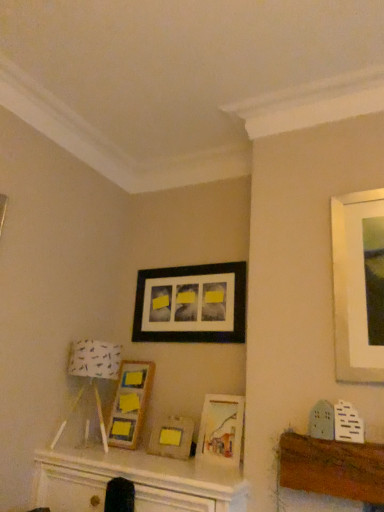
Question: Would you say black matte picture frame at upper center, which ranks as the 4th picture frame in bottom-to-top order, is part of matte silver picture frame at center, arranged as the first picture frame when ordered from the bottom,'s contents?

Choices:
 (A) no
 (B) yes

Answer: (A)

Question: From the image's perspective, is matte silver picture frame at center, which is counted as the fourth picture frame, starting from the top, under black matte picture frame at upper center, which ranks as the 4th picture frame in bottom-to-top order?

Choices:
 (A) no
 (B) yes

Answer: (B)

Question: Is matte silver picture frame at center, arranged as the first picture frame when ordered from the bottom, to the left of black matte picture frame at upper center, which ranks as the 4th picture frame in bottom-to-top order, from the viewer's perspective?

Choices:
 (A) yes
 (B) no

Answer: (A)

Question: Can you confirm if matte silver picture frame at center, which is counted as the fourth picture frame, starting from the top, is shorter than black matte picture frame at upper center, which ranks as the 4th picture frame in bottom-to-top order?

Choices:
 (A) yes
 (B) no

Answer: (A)

Question: Is matte silver picture frame at center, which is counted as the fourth picture frame, starting from the top, to the right of black matte picture frame at upper center, which ranks as the 1th picture frame in top-to-bottom order, from the viewer's perspective?

Choices:
 (A) no
 (B) yes

Answer: (A)

Question: From the image's perspective, is matte silver picture frame at center, which is counted as the fourth picture frame, starting from the top, located above black matte picture frame at upper center, which ranks as the 4th picture frame in bottom-to-top order?

Choices:
 (A) no
 (B) yes

Answer: (A)

Question: Is white fabric lampshade at left next to matte silver picture frame at center, arranged as the first picture frame when ordered from the bottom, and touching it?

Choices:
 (A) yes
 (B) no

Answer: (B)

Question: From a real-world perspective, is white fabric lampshade at left physically below matte silver picture frame at center, which is counted as the fourth picture frame, starting from the top?

Choices:
 (A) yes
 (B) no

Answer: (B)

Question: From the image's perspective, is white fabric lampshade at left on top of matte silver picture frame at center, which is counted as the fourth picture frame, starting from the top?

Choices:
 (A) no
 (B) yes

Answer: (B)

Question: From the image's perspective, is white fabric lampshade at left under matte silver picture frame at center, which is counted as the fourth picture frame, starting from the top?

Choices:
 (A) no
 (B) yes

Answer: (A)

Question: Does white fabric lampshade at left have a lesser height compared to matte silver picture frame at center, which is counted as the fourth picture frame, starting from the top?

Choices:
 (A) yes
 (B) no

Answer: (B)

Question: Can you confirm if white fabric lampshade at left is positioned to the right of matte silver picture frame at center, which is counted as the fourth picture frame, starting from the top?

Choices:
 (A) yes
 (B) no

Answer: (B)

Question: Is matte wooden picture frame at center, which is counted as the third picture frame, starting from the top, touching black matte picture frame at upper center, which ranks as the 4th picture frame in bottom-to-top order?

Choices:
 (A) no
 (B) yes

Answer: (A)